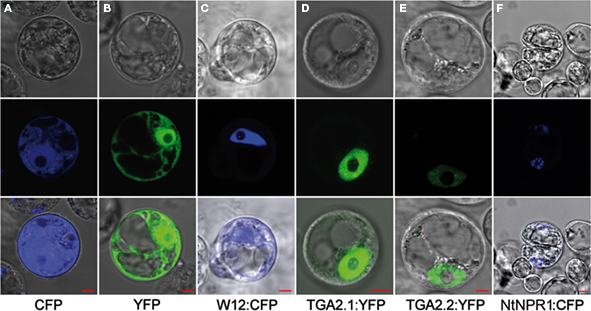
You are a GUI agent. You are given a task and a screenshot of the screen. Output one action in this format:
    pyautogui.click(x=<x>, y=<y>)
    Task: Click on the column
    The image size is (591, 311).
    Given the screenshot: What is the action you would take?
    pyautogui.click(x=70, y=45), pyautogui.click(x=146, y=50), pyautogui.click(x=236, y=45), pyautogui.click(x=323, y=47), pyautogui.click(x=428, y=61), pyautogui.click(x=545, y=54)